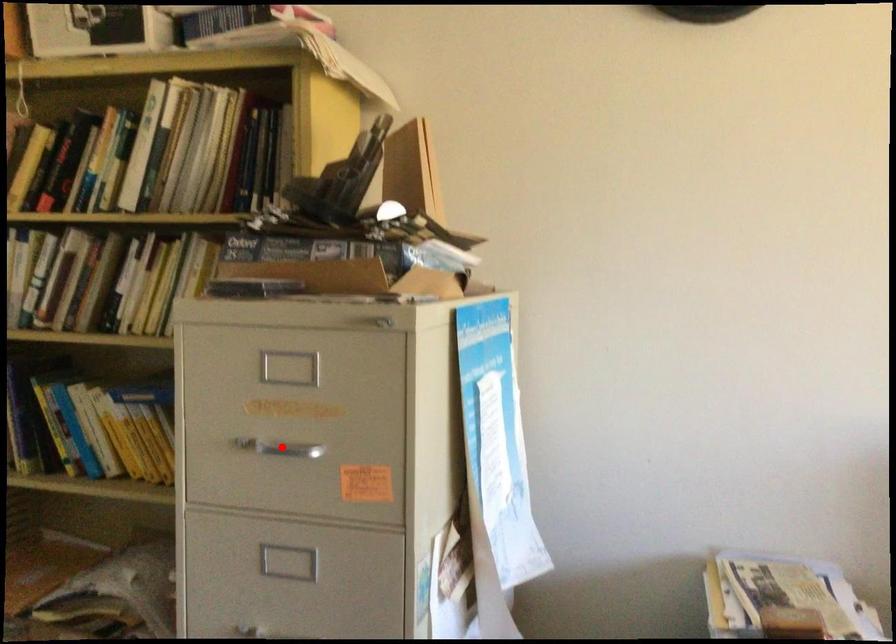
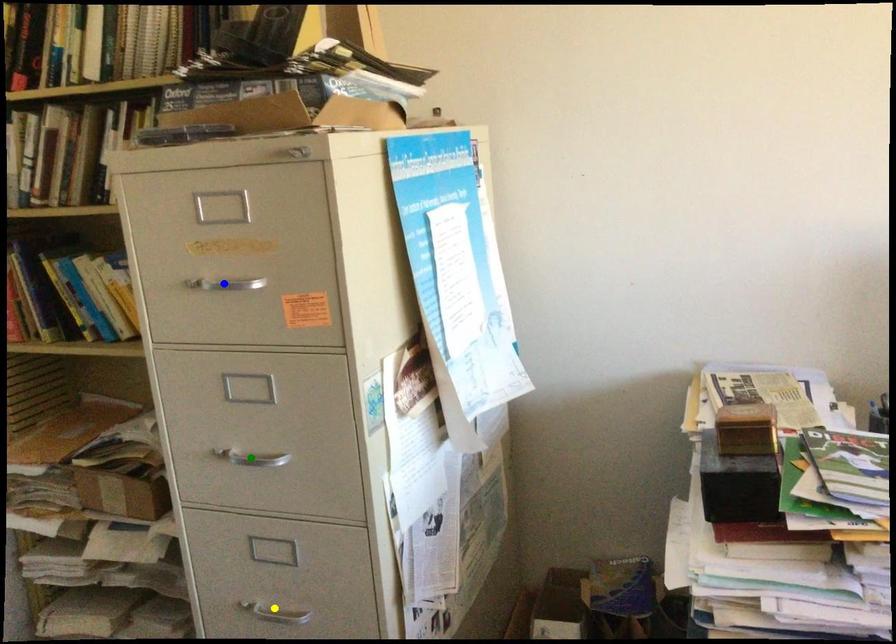
Question: I am providing you with two images of the same scene from different viewpoints. A red point is marked on the first image. You are given multiple points on the second image. Which point in image 2 represents the same 3d spot as the red point in image 1?

Choices:
 (A) yellow point
 (B) blue point
 (C) green point

Answer: (B)